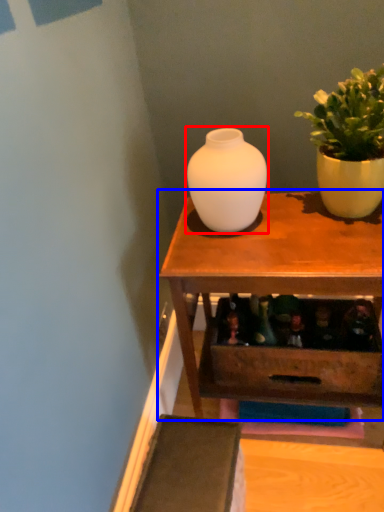
Question: Which object appears closest to the camera in this image, vase (highlighted by a red box) or table (highlighted by a blue box)?

Choices:
 (A) vase
 (B) table

Answer: (B)